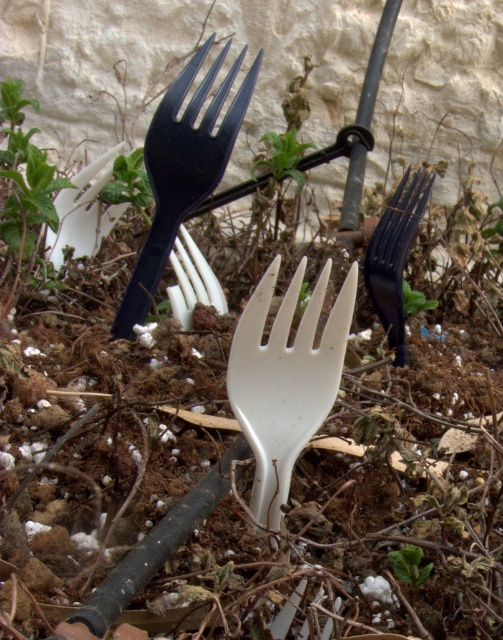
Question: Can you confirm if white matte fork at center is thinner than green leafy weed at lower center?

Choices:
 (A) no
 (B) yes

Answer: (A)

Question: Is black plastic fork at upper left bigger than black plastic fork at center?

Choices:
 (A) yes
 (B) no

Answer: (B)

Question: Among these objects, which one is nearest to the camera?

Choices:
 (A) white matte fork at center
 (B) white plastic fork at center
 (C) black plastic fork at center

Answer: (A)

Question: Considering the relative positions of white matte fork at center and black plastic fork at upper left in the image provided, where is white matte fork at center located with respect to black plastic fork at upper left?

Choices:
 (A) left
 (B) right

Answer: (B)

Question: Among these points, which one is farthest from the camera?

Choices:
 (A) (203, 276)
 (B) (400, 301)
 (C) (159, 234)

Answer: (A)

Question: Which of the following is the closest to the observer?

Choices:
 (A) (242, 432)
 (B) (184, 300)
 (C) (180, 140)

Answer: (A)